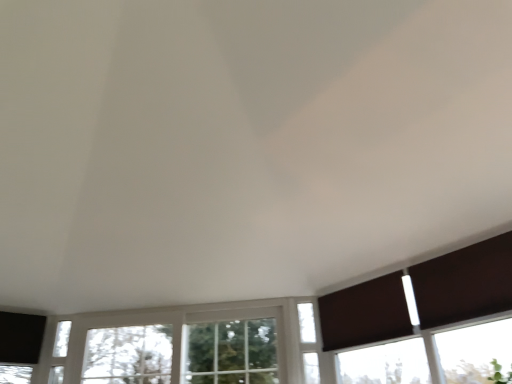
Question: Does clear glass window at center, marked as the second window in a left-to-right arrangement, have a lesser width compared to white glass window at center, which is the 3th window in left-to-right order?

Choices:
 (A) no
 (B) yes

Answer: (A)

Question: From a real-world perspective, is clear glass window at center, positioned as the second window in right-to-left order, beneath white glass window at center, which appears as the first window when viewed from the right?

Choices:
 (A) yes
 (B) no

Answer: (B)

Question: Is white glass window at center, which is the 3th window in left-to-right order, located within clear glass window at center, positioned as the second window in right-to-left order?

Choices:
 (A) yes
 (B) no

Answer: (B)

Question: Does clear glass window at center, positioned as the second window in right-to-left order, touch white glass window at center, which appears as the first window when viewed from the right?

Choices:
 (A) no
 (B) yes

Answer: (A)

Question: Can you confirm if clear glass window at center, marked as the second window in a left-to-right arrangement, is smaller than white glass window at center, which is the 3th window in left-to-right order?

Choices:
 (A) no
 (B) yes

Answer: (A)

Question: Considering the positions of white glass window at center, which is the 3th window in left-to-right order, and white glass window at lower left, which is the 1th window in left-to-right order, in the image, is white glass window at center, which is the 3th window in left-to-right order, taller or shorter than white glass window at lower left, which is the 1th window in left-to-right order,?

Choices:
 (A) tall
 (B) short

Answer: (A)

Question: Does point (305, 321) appear closer or farther from the camera than point (59, 360)?

Choices:
 (A) farther
 (B) closer

Answer: (B)

Question: In terms of size, does white glass window at center, which is the 3th window in left-to-right order, appear bigger or smaller than white glass window at lower left, marked as the third window in a right-to-left arrangement?

Choices:
 (A) big
 (B) small

Answer: (A)

Question: Choose the correct answer: Is white glass window at center, which is the 3th window in left-to-right order, inside white glass window at lower left, which is the 1th window in left-to-right order, or outside it?

Choices:
 (A) outside
 (B) inside

Answer: (A)

Question: Does point (488, 276) appear closer or farther from the camera than point (314, 379)?

Choices:
 (A) closer
 (B) farther

Answer: (A)

Question: Visually, is brown matte shutter at right positioned to the left or to the right of white glass window at center, which is the 3th window in left-to-right order?

Choices:
 (A) left
 (B) right

Answer: (B)

Question: From a real-world perspective, relative to white glass window at center, which appears as the first window when viewed from the right, is brown matte shutter at right vertically above or below?

Choices:
 (A) above
 (B) below

Answer: (A)

Question: In terms of size, does brown matte shutter at right appear bigger or smaller than white glass window at center, which is the 3th window in left-to-right order?

Choices:
 (A) small
 (B) big

Answer: (B)

Question: Considering their positions, is clear glass window at center, positioned as the second window in right-to-left order, located in front of or behind brown fabric curtain at lower right?

Choices:
 (A) behind
 (B) front

Answer: (A)

Question: Choose the correct answer: Is clear glass window at center, positioned as the second window in right-to-left order, inside brown fabric curtain at lower right or outside it?

Choices:
 (A) inside
 (B) outside

Answer: (B)